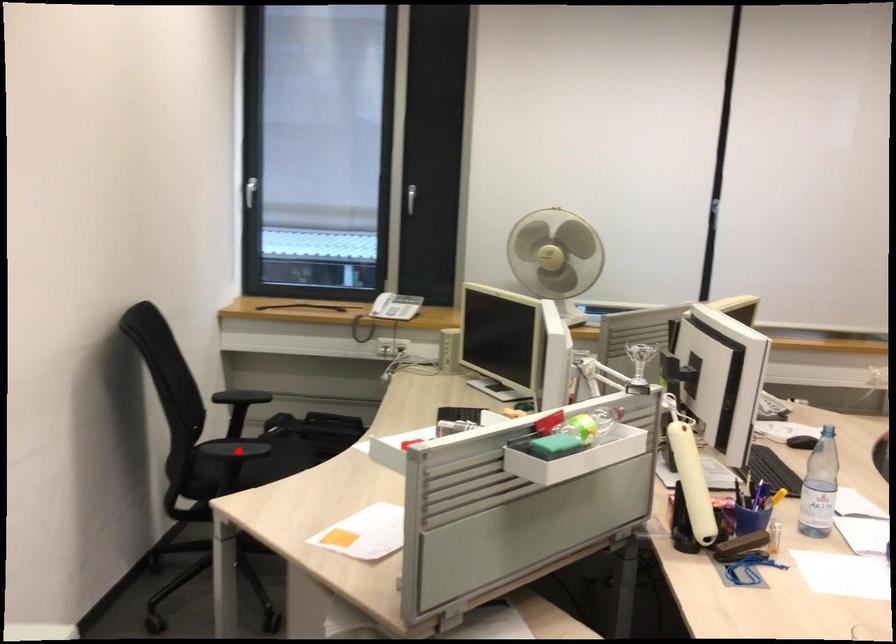
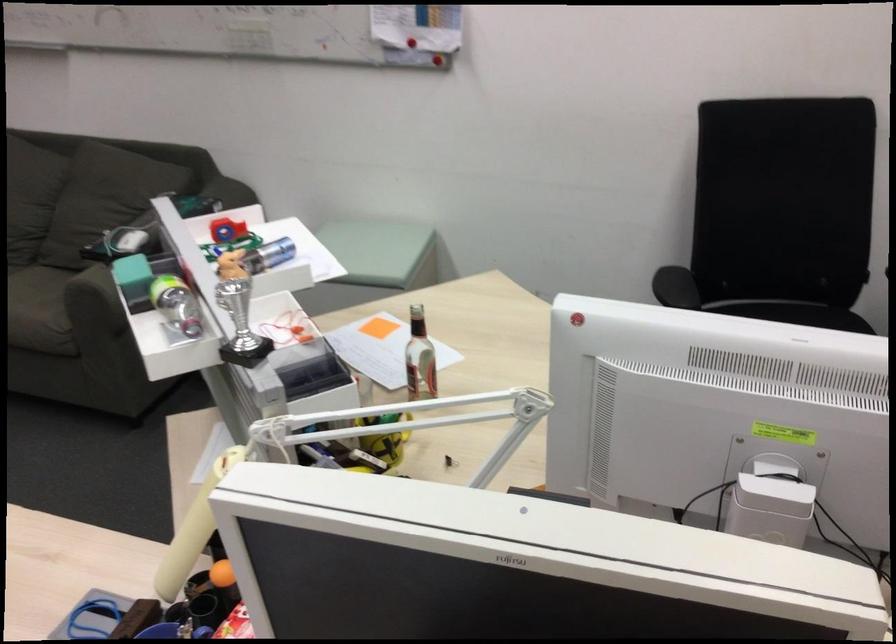
Find the pixel in the second image that matches the highlighted location in the first image.

(675, 287)